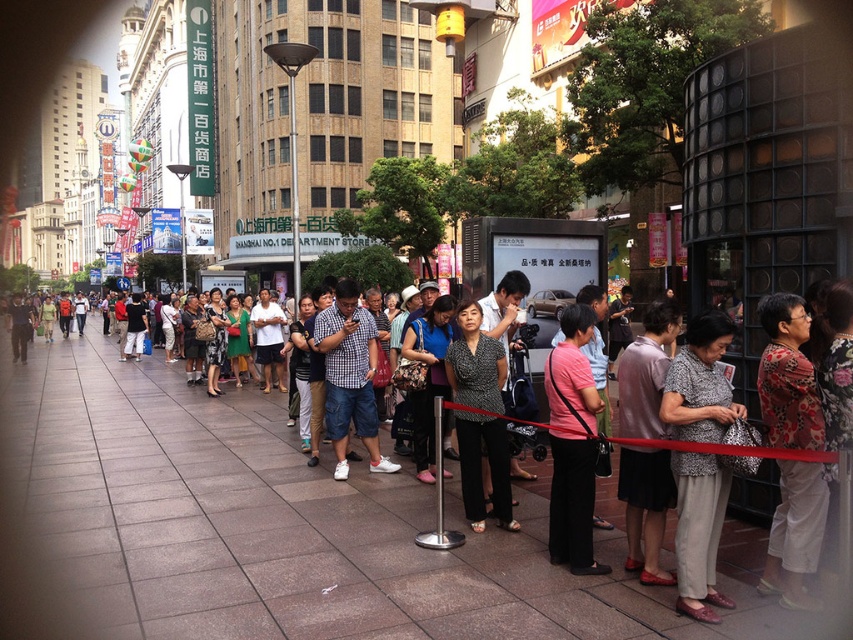
Question: Is brown stone pavement at center positioned at the back of matte pink blouse at center?

Choices:
 (A) yes
 (B) no

Answer: (B)

Question: Estimate the real-world distances between objects in this image. Which object is farther from the brown stone pavement at center?

Choices:
 (A) checkered fabric shirt at center
 (B) printed fabric blouse at center

Answer: (B)

Question: Which object appears farthest from the camera in this image?

Choices:
 (A) pink fabric shirt at center
 (B) floral-patterned blouse at lower right
 (C) checkered fabric shirt at center

Answer: (C)

Question: Does floral-patterned blouse at lower right appear over checkered fabric shirt at center?

Choices:
 (A) no
 (B) yes

Answer: (A)

Question: Is matte pink blouse at center thinner than black dotted blouse at center?

Choices:
 (A) no
 (B) yes

Answer: (B)

Question: Which point is closer to the camera?

Choices:
 (A) pink fabric shirt at center
 (B) checkered fabric shirt at center
 (C) floral-patterned blouse at lower right
 (D) black dotted blouse at center

Answer: (C)